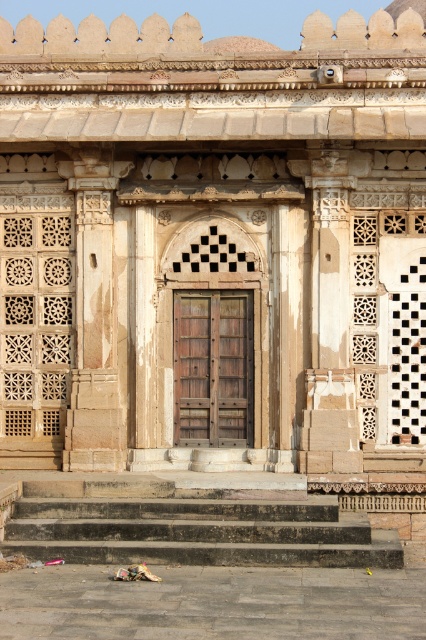
Does point (347, 545) lie behind point (181, 426)?

No, (347, 545) is closer to viewer.

Is dark gray stone stairs at lower center below wooden textured door at center?

Yes, dark gray stone stairs at lower center is below wooden textured door at center.

Is point (368, 538) behind point (227, 381)?

No.

Identify the location of dark gray stone stairs at lower center. The image size is (426, 640). (190, 529).